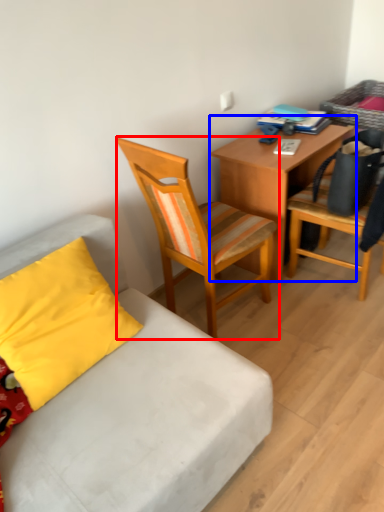
Question: Among these objects, which one is nearest to the camera, chair (highlighted by a red box) or desk (highlighted by a blue box)?

Choices:
 (A) chair
 (B) desk

Answer: (A)